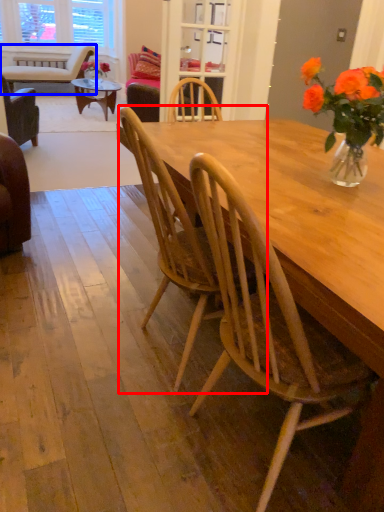
Question: Among these objects, which one is nearest to the camera, chair (highlighted by a red box) or chair (highlighted by a blue box)?

Choices:
 (A) chair
 (B) chair

Answer: (A)